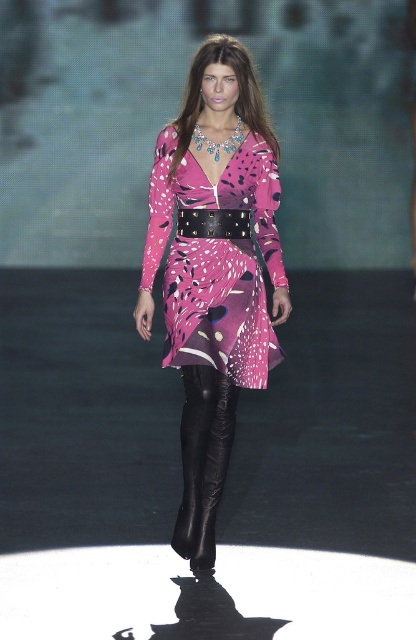
You are a fashion designer observing the runway show. You need to adjust the model to ensure the black leather pants at center and the black leather belt at center are positioned correctly. Based on their current placement, which object is located to the left?

The black leather pants at center is to the left of the black leather belt at center according to the description.

You are a fashion designer observing the runway show and notice the model wearing the black leather pants at center and the black leather belt at center. Which item is positioned higher on the model?

The black leather pants at center is taller than black leather belt at center, so the black leather pants at center is positioned higher on the model.